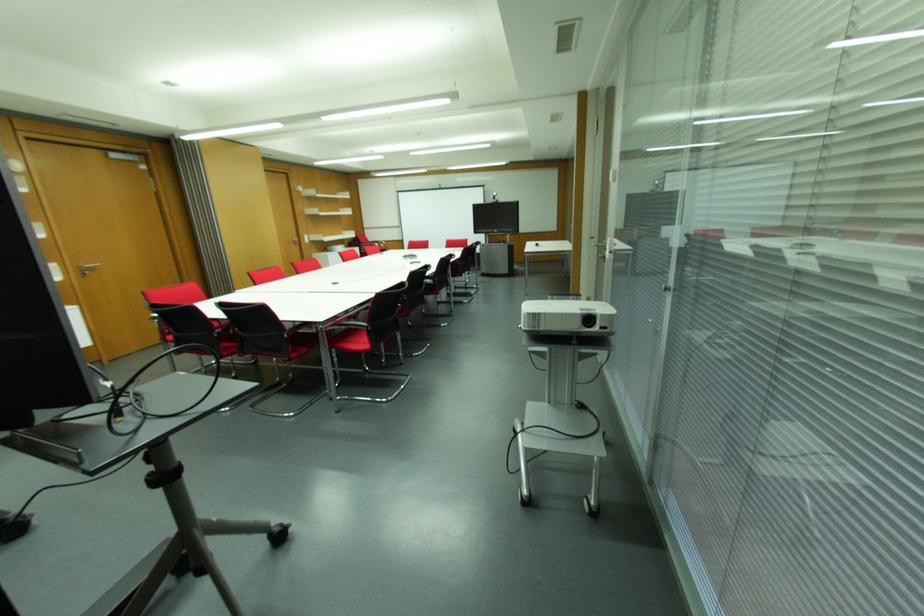
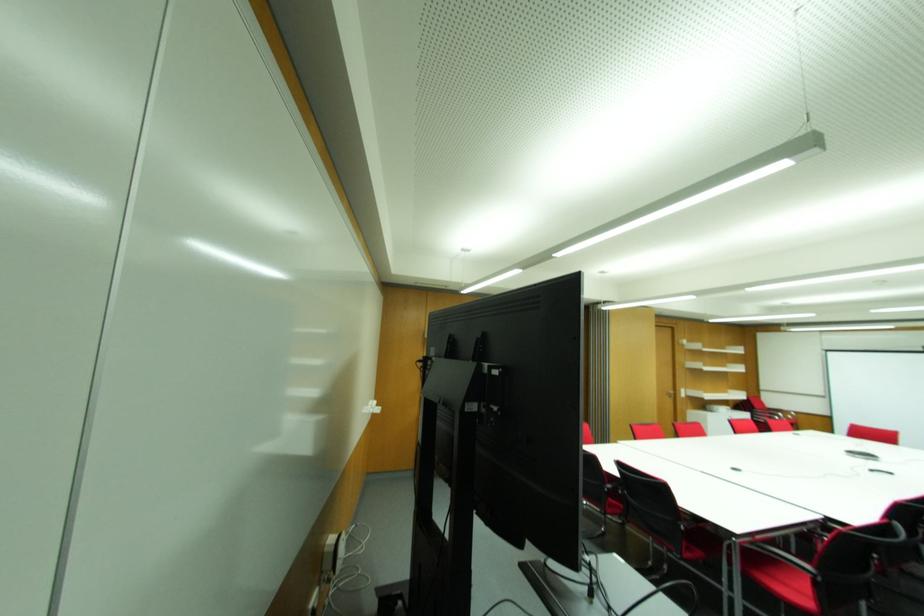
Find the pixel in the second image that matches the point at 368,323 in the first image.

(816, 569)